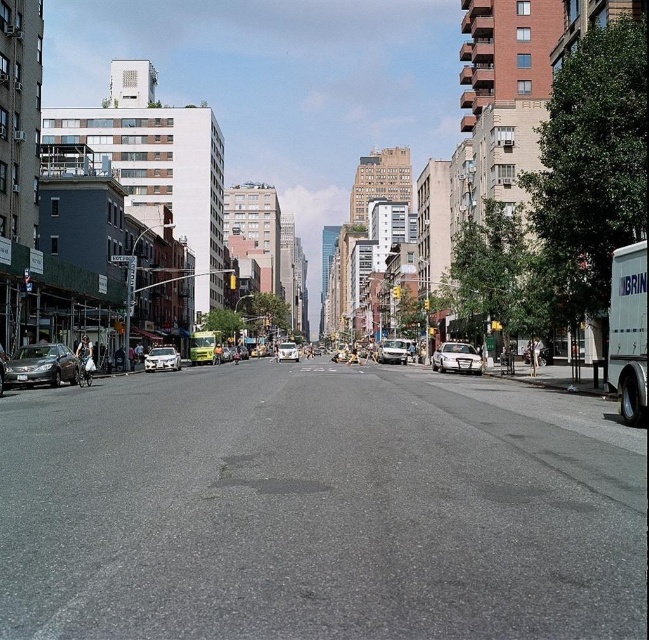
How far apart are shiny silver sedan at left and silver metallic sedan at center?

40.64 meters

Is shiny silver sedan at left bigger than silver metallic sedan at center?

No.

Which is behind, point (8, 372) or point (387, 342)?

The point (387, 342) is behind.

Where is `shiny silver sedan at left`? This screenshot has width=649, height=640. shiny silver sedan at left is located at coordinates (42, 365).

Measure the distance from shiny silver sedan at left to white glossy car at center.

shiny silver sedan at left and white glossy car at center are 25.32 meters apart from each other.

Is point (18, 368) positioned behind point (448, 362)?

That is False.

Which is in front, point (66, 346) or point (471, 353)?

Positioned in front is point (66, 346).

Where is `shiny silver sedan at left`? The image size is (649, 640). shiny silver sedan at left is located at coordinates (42, 365).

Measure the distance between point [406,348] and camera.

Point [406,348] is 221.68 feet from camera.

Does silver metallic sedan at center have a smaller size compared to shiny silver car at center?

Correct, silver metallic sedan at center occupies less space than shiny silver car at center.

The width and height of the screenshot is (649, 640). What do you see at coordinates (393, 352) in the screenshot? I see `silver metallic sedan at center` at bounding box center [393, 352].

This screenshot has height=640, width=649. I want to click on silver metallic sedan at center, so click(x=393, y=352).